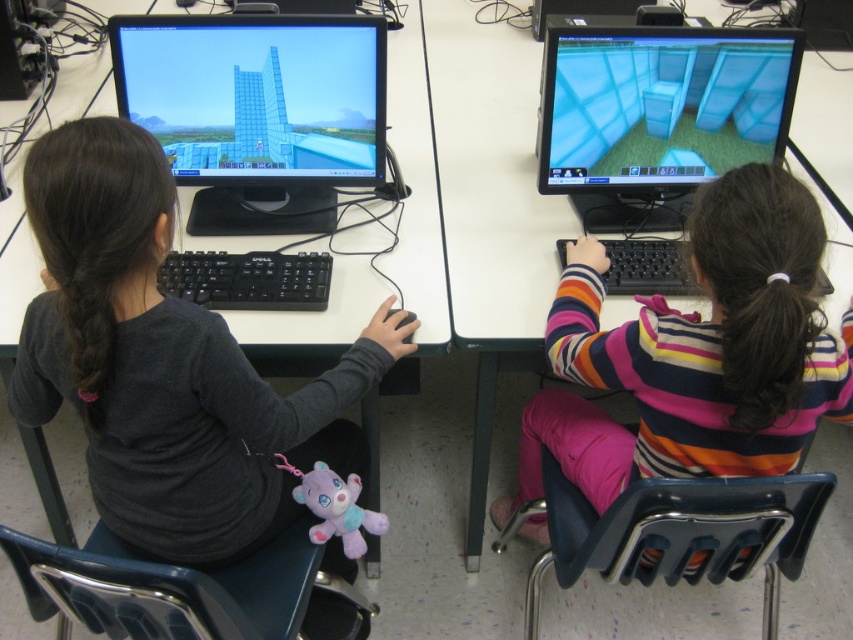
The image size is (853, 640). What do you see at coordinates (695, 353) in the screenshot?
I see `striped sweater at right` at bounding box center [695, 353].

Is striped sweater at right to the left of transparent glass monitor at upper left from the viewer's perspective?

No, striped sweater at right is not to the left of transparent glass monitor at upper left.

This screenshot has width=853, height=640. What do you see at coordinates (695, 353) in the screenshot?
I see `striped sweater at right` at bounding box center [695, 353].

The width and height of the screenshot is (853, 640). I want to click on striped sweater at right, so click(x=695, y=353).

Does transparent glass computer monitor at upper right appear on the right side of purple plush toy at lower center?

Indeed, transparent glass computer monitor at upper right is positioned on the right side of purple plush toy at lower center.

Does transparent glass computer monitor at upper right appear over purple plush toy at lower center?

Correct, transparent glass computer monitor at upper right is located above purple plush toy at lower center.

At what (x,y) coordinates should I click in order to perform the action: click on transparent glass computer monitor at upper right. Please return your answer as a coordinate pair (x, y). Looking at the image, I should click on (x=659, y=115).

Can you confirm if striped sweater at right is positioned to the left of purple plush toy at lower center?

In fact, striped sweater at right is to the right of purple plush toy at lower center.

Between striped sweater at right and purple plush toy at lower center, which one has less height?

With less height is purple plush toy at lower center.

Who is more distant from viewer, (643, 458) or (318, 493)?

Point (318, 493)

Image resolution: width=853 pixels, height=640 pixels. Identify the location of striped sweater at right. (695, 353).